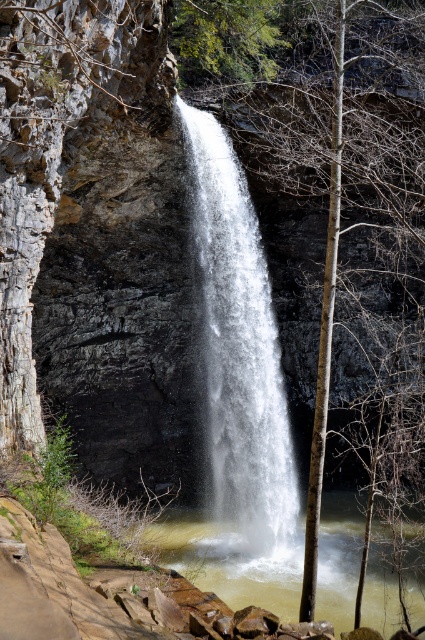
You are standing at the edge of the cliff overlooking the waterfall. You see a bare wood tree at center and a clear water at center. Which object is positioned to the right side from your viewpoint?

The bare wood tree at center is to the right of the clear water at center from your viewpoint.

You are a hiker standing at the edge of the cliff overlooking the waterfall. You see a bare wood tree at center and white frothy water at center. Which object is located above the other?

The bare wood tree at center is positioned over white frothy water at center, meaning the tree is above the water.